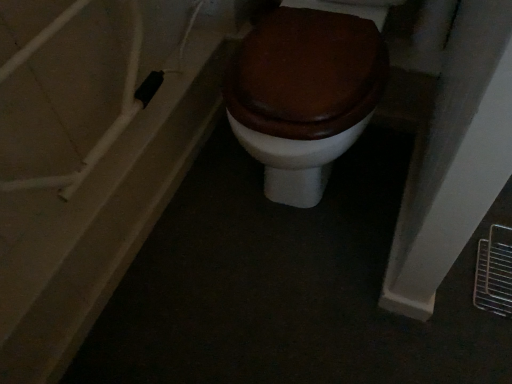
Question: Is matte brown wood toilet at center a part of matte white door at left?

Choices:
 (A) no
 (B) yes

Answer: (A)

Question: From a real-world perspective, is matte white door at left under matte brown wood toilet at center?

Choices:
 (A) no
 (B) yes

Answer: (B)

Question: Considering the relative sizes of matte white door at left and matte brown wood toilet at center in the image provided, is matte white door at left shorter than matte brown wood toilet at center?

Choices:
 (A) yes
 (B) no

Answer: (A)

Question: Is matte white door at left positioned before matte brown wood toilet at center?

Choices:
 (A) yes
 (B) no

Answer: (B)

Question: Is matte white door at left positioned far away from matte brown wood toilet at center?

Choices:
 (A) no
 (B) yes

Answer: (A)

Question: Would you say matte white door at left is outside matte brown wood toilet at center?

Choices:
 (A) yes
 (B) no

Answer: (A)

Question: Is matte brown wood toilet at center positioned behind matte white door at left?

Choices:
 (A) yes
 (B) no

Answer: (B)

Question: Is matte brown wood toilet at center oriented away from matte white door at left?

Choices:
 (A) no
 (B) yes

Answer: (A)

Question: Considering the relative sizes of matte brown wood toilet at center and matte white door at left in the image provided, is matte brown wood toilet at center smaller than matte white door at left?

Choices:
 (A) no
 (B) yes

Answer: (A)

Question: Could you tell me if matte brown wood toilet at center is facing matte white door at left?

Choices:
 (A) no
 (B) yes

Answer: (A)

Question: From the image's perspective, does matte brown wood toilet at center appear lower than matte white door at left?

Choices:
 (A) no
 (B) yes

Answer: (A)

Question: Is matte brown wood toilet at center with matte white door at left?

Choices:
 (A) no
 (B) yes

Answer: (A)

Question: Is matte white door at left taller or shorter than matte brown wood toilet at center?

Choices:
 (A) short
 (B) tall

Answer: (A)